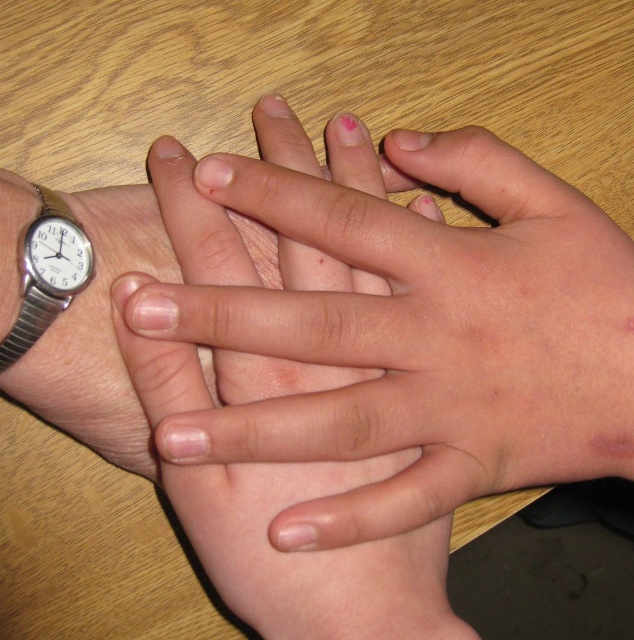
Question: Which point is closer to the camera?

Choices:
 (A) silver metallic watch at left
 (B) smooth skin hands at center

Answer: (A)

Question: Which point appears farthest from the camera in this image?

Choices:
 (A) [472, 364]
 (B) [37, 273]

Answer: (A)

Question: Does smooth skin hands at center appear over silver metallic watch at left?

Choices:
 (A) no
 (B) yes

Answer: (A)

Question: Is smooth skin hands at center positioned at the back of silver metallic watch at left?

Choices:
 (A) yes
 (B) no

Answer: (A)

Question: Which of the following is the closest to the observer?

Choices:
 (A) silver metallic watch at left
 (B) smooth skin hands at center

Answer: (A)

Question: Can you confirm if smooth skin hands at center is bigger than silver metallic watch at left?

Choices:
 (A) yes
 (B) no

Answer: (A)